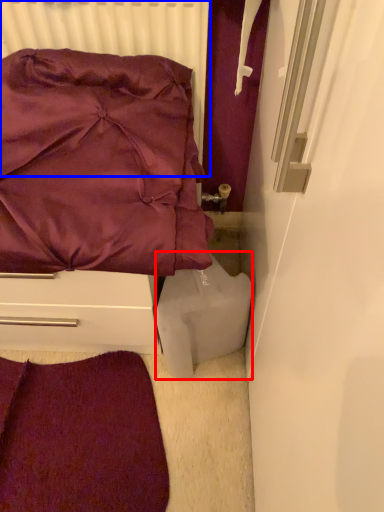
Question: Which object appears farthest to the camera in this image, wide (highlighted by a red box) or radiator (highlighted by a blue box)?

Choices:
 (A) wide
 (B) radiator

Answer: (A)